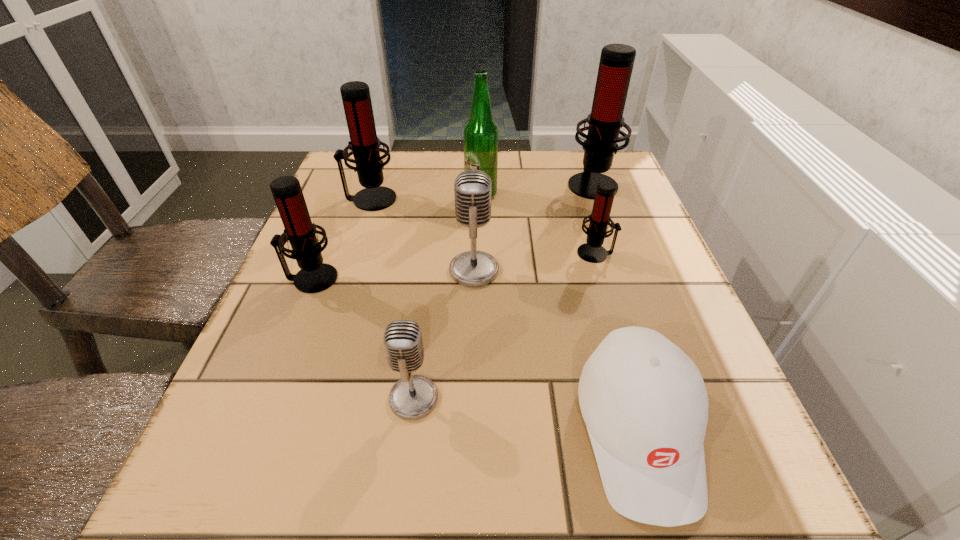
Find the location of `the tallest microphone`. the tallest microphone is located at coordinates (616, 63).

Locate an element on the screen. This screenshot has width=960, height=540. green beer bottle is located at coordinates (480, 132).

I want to click on the second biggest red microphone, so click(x=364, y=144).

Where is `the third microphone from right to left`? the third microphone from right to left is located at coordinates (473, 188).

At what (x,y) coordinates should I click in order to perform the action: click on the bigger gray microphone. Please return your answer as a coordinate pair (x, y). The height and width of the screenshot is (540, 960). Looking at the image, I should click on (473, 188).

Identify the location of the nearest red microphone. This screenshot has height=540, width=960. (315, 276).

The height and width of the screenshot is (540, 960). I want to click on the second nearest red microphone, so click(592, 251).

The width and height of the screenshot is (960, 540). In order to click on the left gray microphone in this screenshot , I will do `click(413, 397)`.

Locate an element on the screen. the third object from left to right is located at coordinates 413,397.

The height and width of the screenshot is (540, 960). Identify the location of baseball cap. (644, 402).